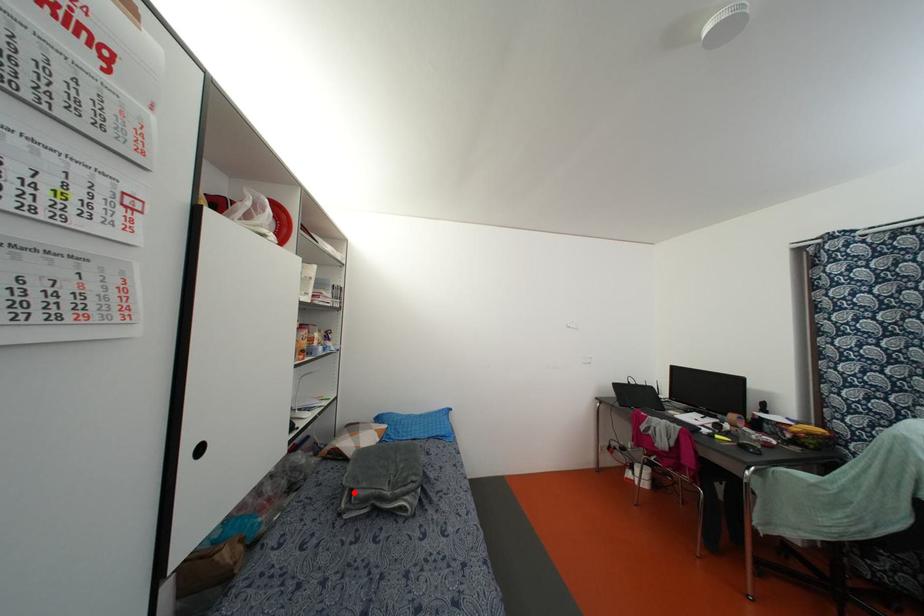
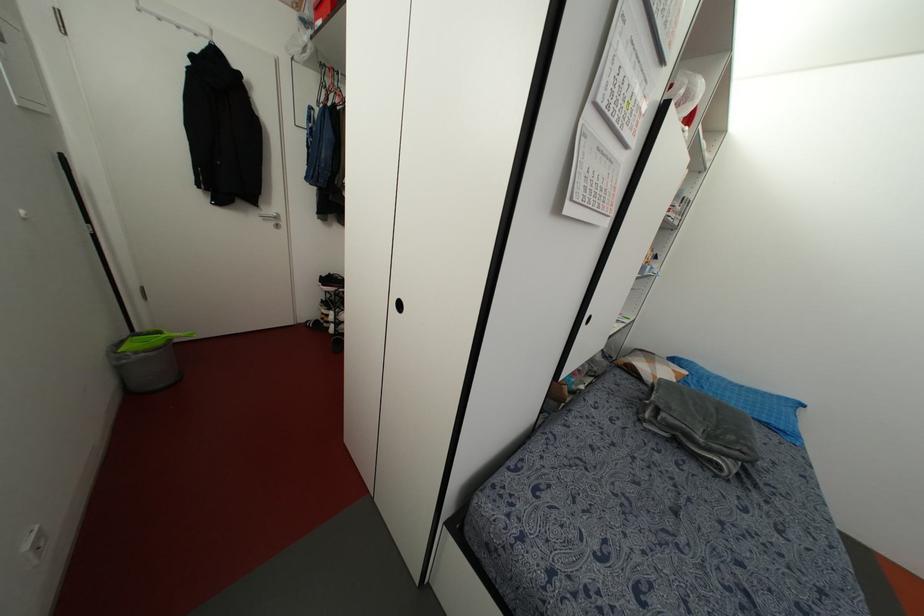
Locate, in the second image, the point that corresponds to the highlighted location in the first image.

(663, 415)